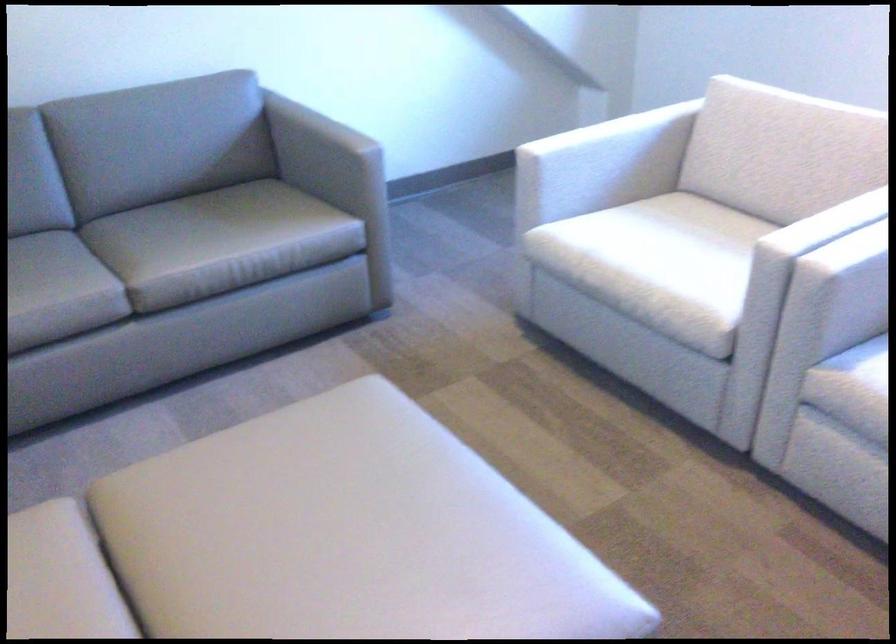
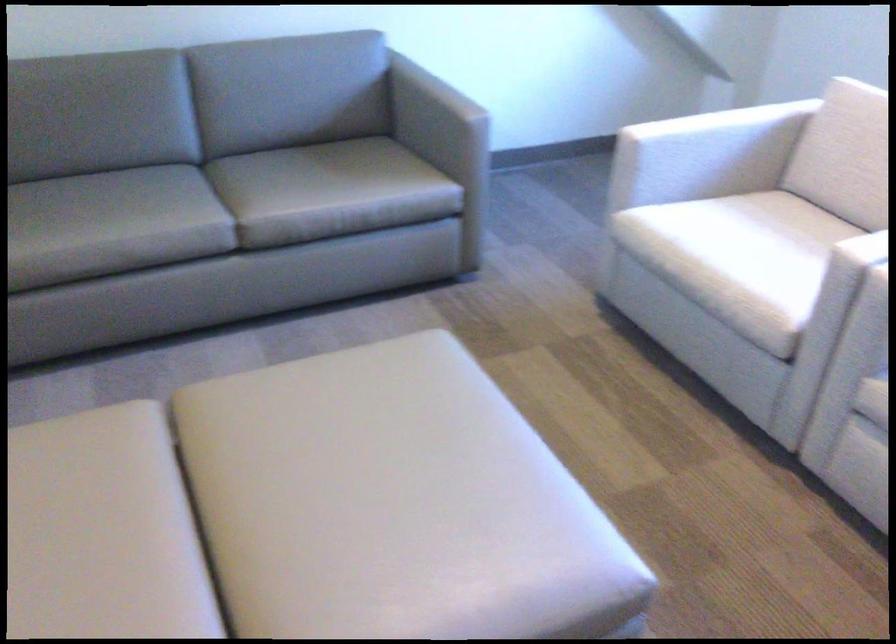
Where in the second image is the point corresponding to (x=795, y=240) from the first image?

(872, 250)